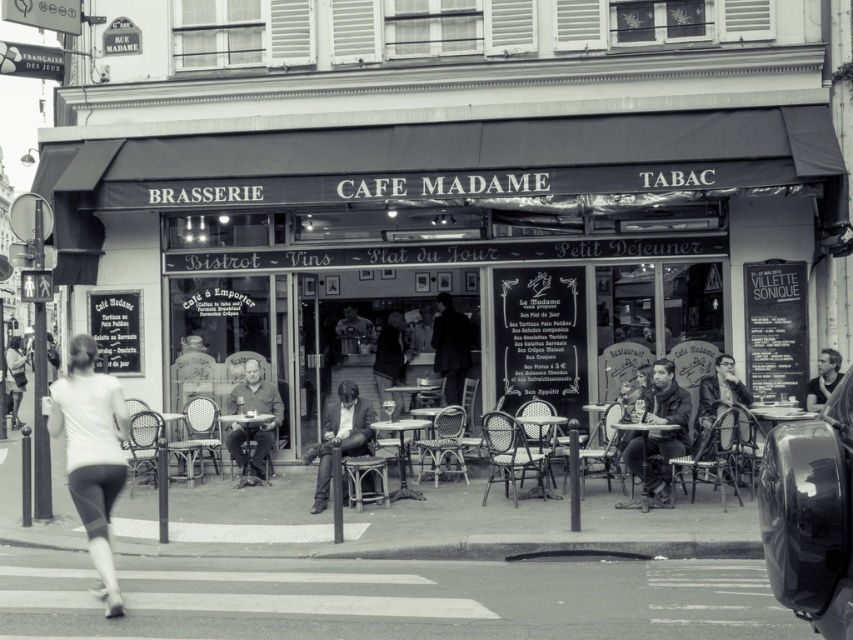
Question: Which object appears closest to the camera in this image?

Choices:
 (A) dark fabric coat at center
 (B) matte black jacket at right
 (C) dark fabric jacket at center
 (D) matte black jacket at lower left

Answer: (B)

Question: Can you confirm if matte black awning at upper center is smaller than smooth leather jacket at center?

Choices:
 (A) no
 (B) yes

Answer: (A)

Question: Which point is farther to the camera?

Choices:
 (A) (247, 401)
 (B) (306, 461)

Answer: (B)

Question: Is matte black awning at upper center positioned at the back of matte black jacket at right?

Choices:
 (A) yes
 (B) no

Answer: (A)

Question: Estimate the real-world distances between objects in this image. Which object is closer to the matte black suit at center?

Choices:
 (A) white fabric pants at lower left
 (B) dark fabric jacket at center

Answer: (B)

Question: Is smooth leather jacket at center further to the viewer compared to dark fabric jacket at center?

Choices:
 (A) yes
 (B) no

Answer: (B)